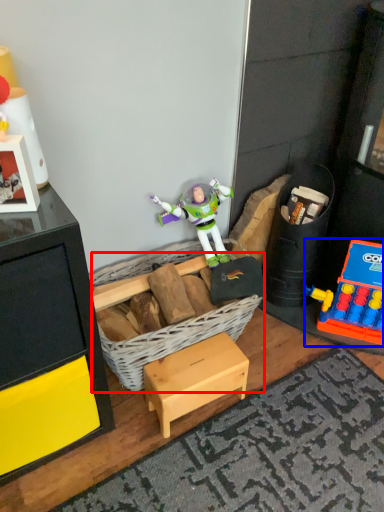
Question: Which object is further to the camera taking this photo, basket (highlighted by a red box) or toy (highlighted by a blue box)?

Choices:
 (A) basket
 (B) toy

Answer: (B)